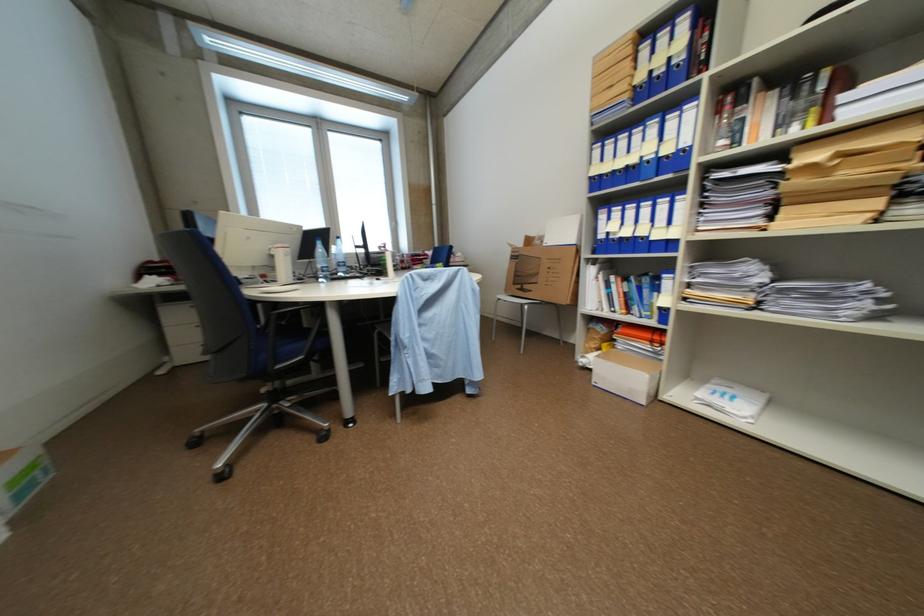
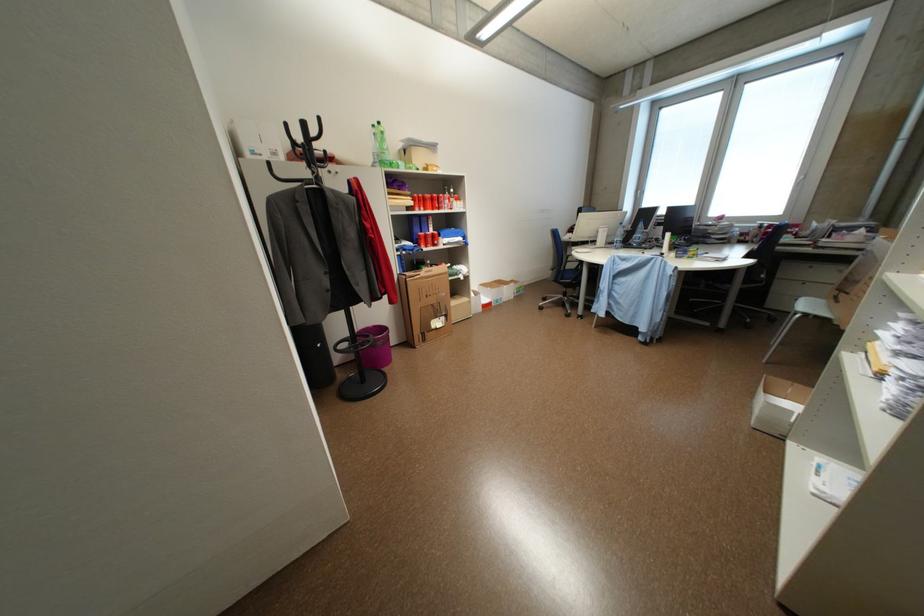
Question: I am providing you with two images of the same scene from different viewpoints. Please identify which objects are invisible in image2.

Choices:
 (A) round patterned box
 (B) clear water bottle
 (C) cardboard box handle
 (D) pink wastebasket

Answer: (B)